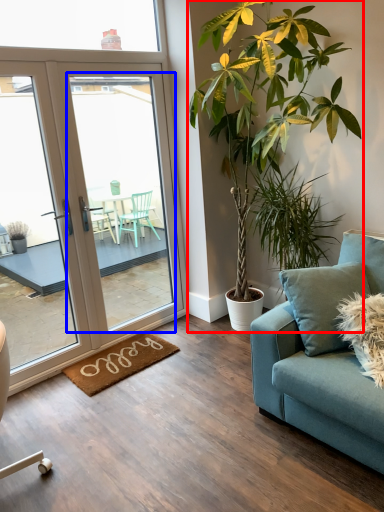
Question: Which of the following is the farthest to the observer, houseplant (highlighted by a red box) or screen door (highlighted by a blue box)?

Choices:
 (A) houseplant
 (B) screen door

Answer: (B)